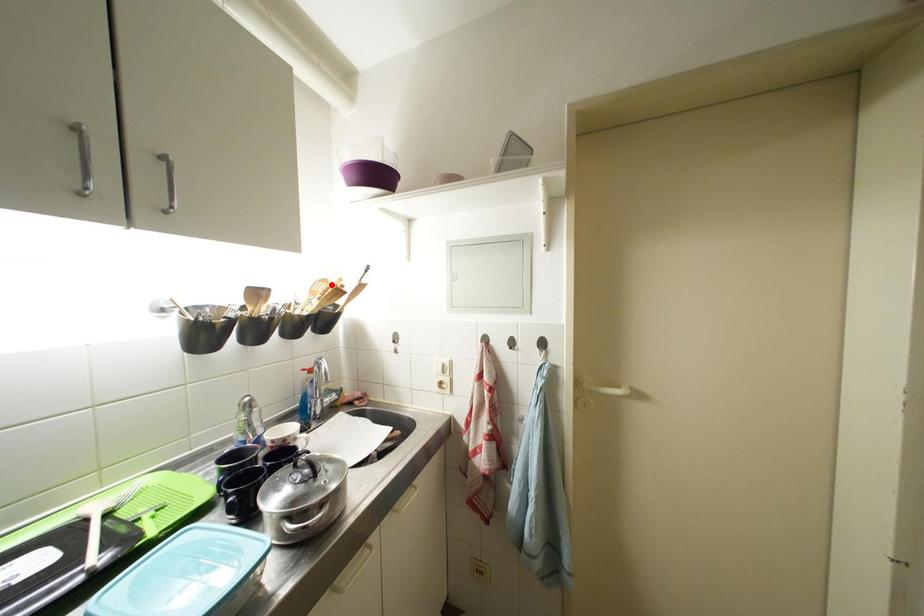
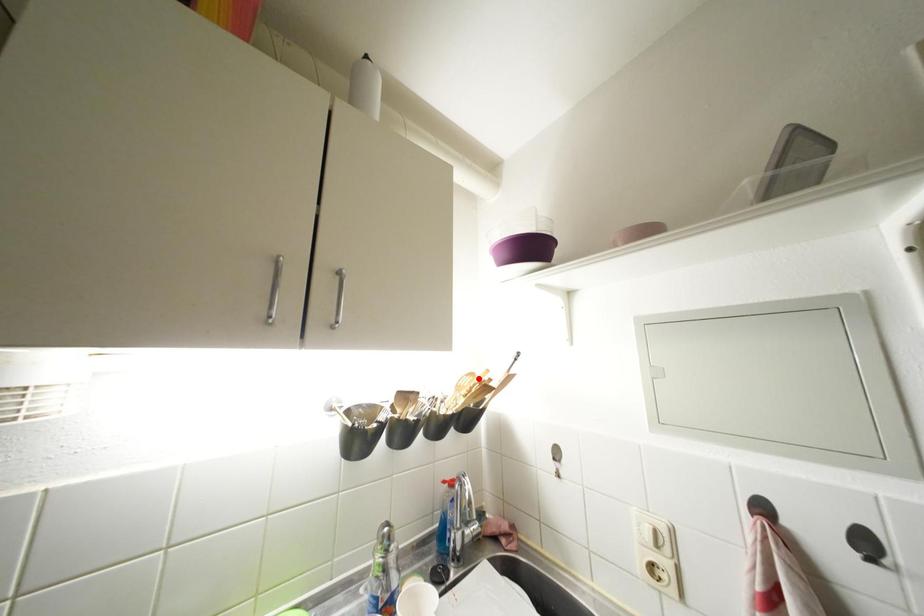
I am providing you with two images of the same scene from different viewpoints. A red point is marked on the first image and another point is marked on the second image. Is the marked point in image1 the same physical position as the marked point in image2?

Yes